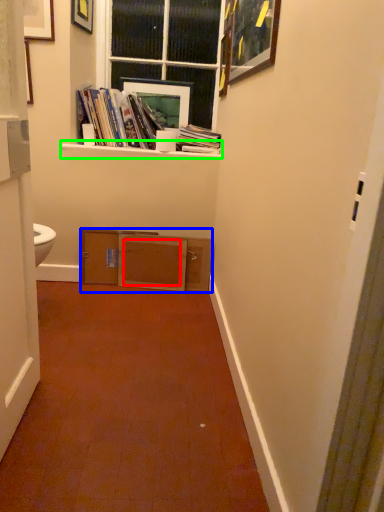
Question: Which is nearer to the drawer (highlighted by a red box)? cabinetry (highlighted by a blue box) or window sill (highlighted by a green box).

Choices:
 (A) cabinetry
 (B) window sill

Answer: (A)